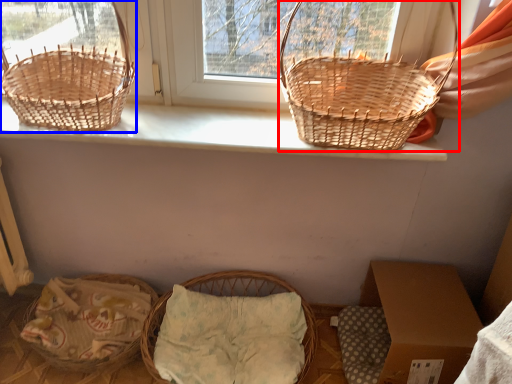
Question: Which object appears closest to the camera in this image, picnic basket (highlighted by a red box) or picnic basket (highlighted by a blue box)?

Choices:
 (A) picnic basket
 (B) picnic basket

Answer: (A)